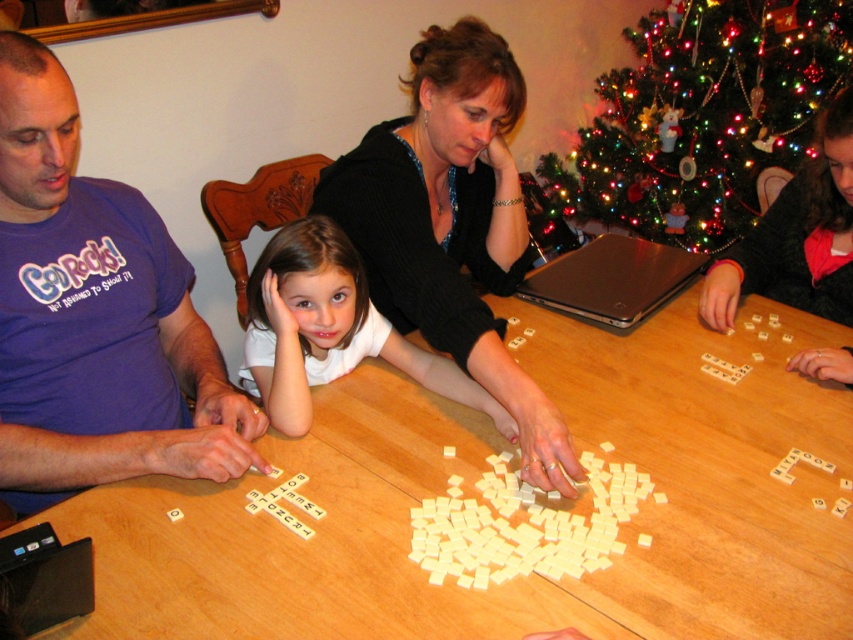
You are a photographer setting up a camera on a tripod. The wooden table at center is in the foreground and the green matte christmas tree at upper center is in the background. To ensure both are in focus, you need to know their heights. Which object is shorter?

The wooden table at center is not as tall as the green matte christmas tree at upper center, so the wooden table at center is shorter.